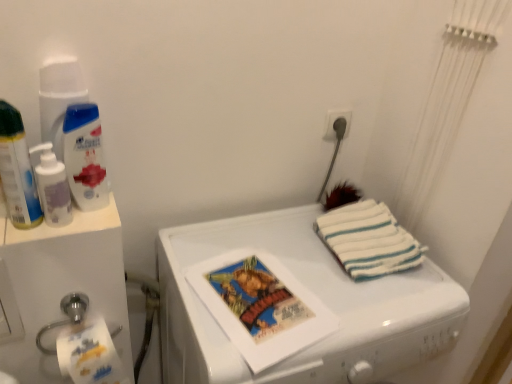
Where is `vacant area in front of white glossy shampoo at upper left, acting as the 2th cleaning product starting from the left`? Image resolution: width=512 pixels, height=384 pixels. vacant area in front of white glossy shampoo at upper left, acting as the 2th cleaning product starting from the left is located at coordinates [x=71, y=231].